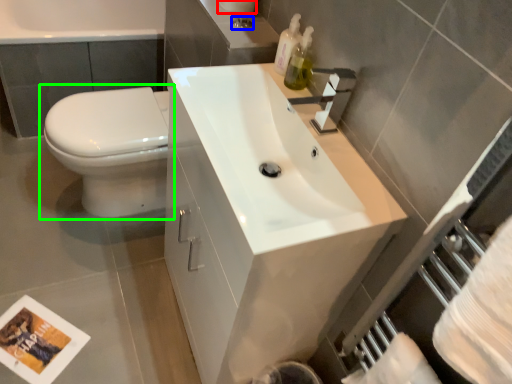
Question: Estimate the real-world distances between objects in this image. Which object is closer to toilet paper (highlighted by a red box), plumbing fixture (highlighted by a blue box) or toilet (highlighted by a green box)?

Choices:
 (A) plumbing fixture
 (B) toilet

Answer: (A)